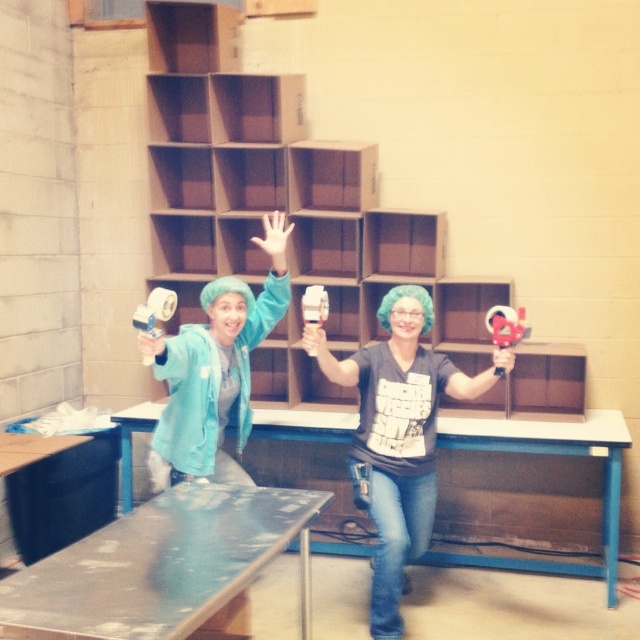
Find the location of a particular element. The width and height of the screenshot is (640, 640). matte gray shirt at center is located at coordinates (397, 436).

Can you confirm if metallic silver table at lower center is positioned below matte gray shirt at center?

Yes, metallic silver table at lower center is below matte gray shirt at center.

Who is more distant from viewer, (115, 582) or (428, 417)?

The point (428, 417) is behind.

The width and height of the screenshot is (640, 640). What do you see at coordinates (161, 564) in the screenshot?
I see `metallic silver table at lower center` at bounding box center [161, 564].

Find the location of a particular element. This screenshot has width=640, height=640. metallic silver table at lower center is located at coordinates (161, 564).

Consider the image. Measure the distance between metallic silver table at lower center and camera.

5.79 feet

You are a GUI agent. You are given a task and a screenshot of the screen. Output one action in this format:
    pyautogui.click(x=<x>, y=<y>)
    Task: Click on the metallic silver table at lower center
    This screenshot has width=640, height=640.
    Given the screenshot: What is the action you would take?
    pyautogui.click(x=161, y=564)

Is point (109, 602) in front of point (349, 426)?

Yes.

Image resolution: width=640 pixels, height=640 pixels. Find the location of `metallic silver table at lower center`. metallic silver table at lower center is located at coordinates (161, 564).